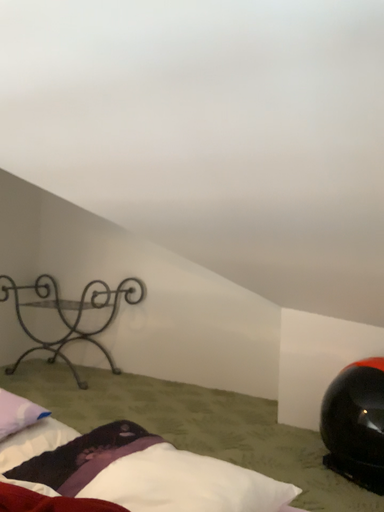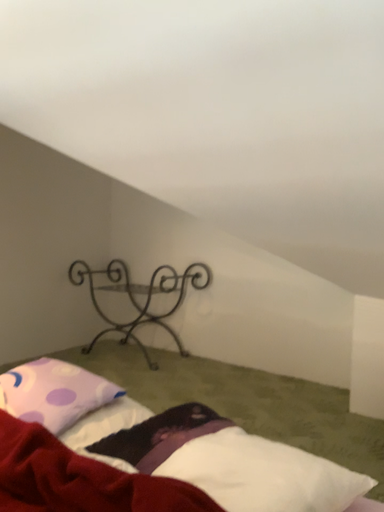
Question: Which way did the camera rotate in the video?

Choices:
 (A) rotated right
 (B) rotated left

Answer: (B)